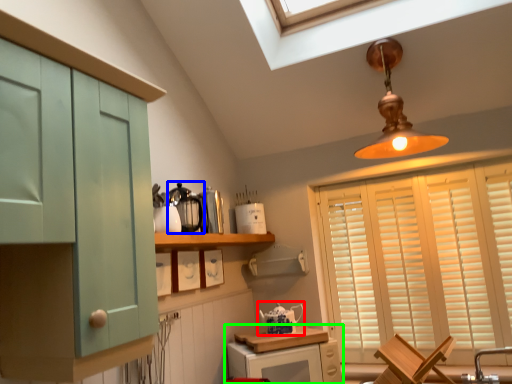
Question: Which is farther away from tea pot (highlighted by a red box)? appliance (highlighted by a blue box) or cabinetry (highlighted by a green box)?

Choices:
 (A) appliance
 (B) cabinetry

Answer: (A)